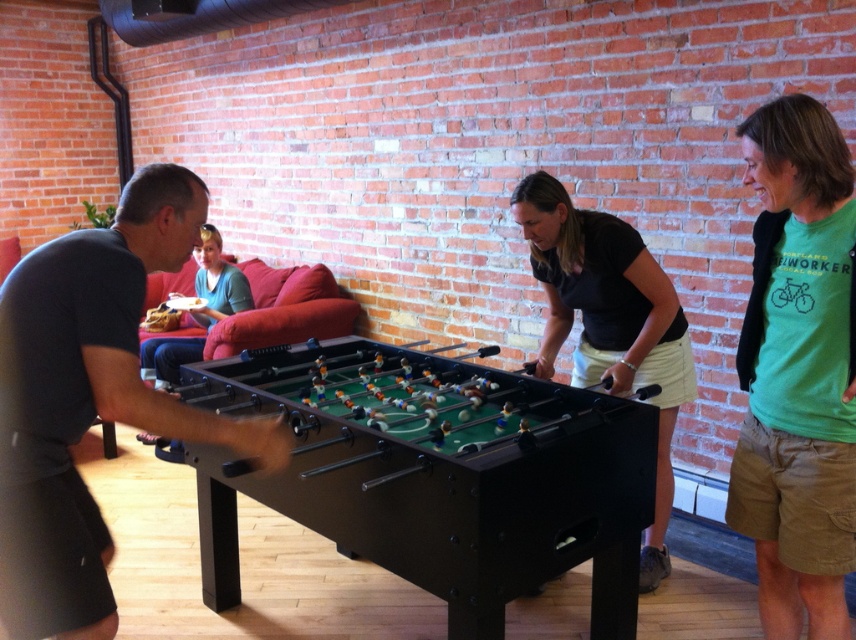
You are a photographer standing behind the black foosball table with a green playing surface. You want to take a photo of the dark gray shirt at left and the black matte shirt at center. Which one is more to the left in the image?

The dark gray shirt at left is more to the left than the black matte shirt at center.

You are standing in the room and see the point at coordinates (798, 369). What object is this point located on?

The point at coordinates (798, 369) is located on the green cotton t shirt at center.

You are a person who is 1.8 meters tall. You want to grab the blue cotton shirt at upper left from where you are standing next to the black plastic foosball table at center. Can you reach it without moving your feet?

The distance between the black plastic foosball table at center and the blue cotton shirt at upper left is 2.21 meters. Since you are 1.8 meters tall, your maximum reach would be around 2.2 meters. Therefore, you can just barely reach the blue cotton shirt at upper left without moving your feet.